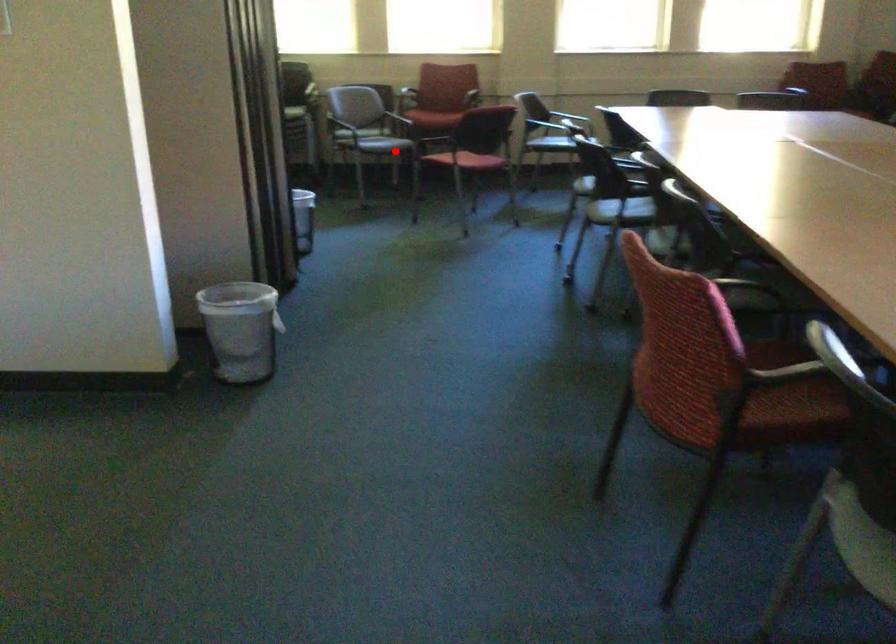
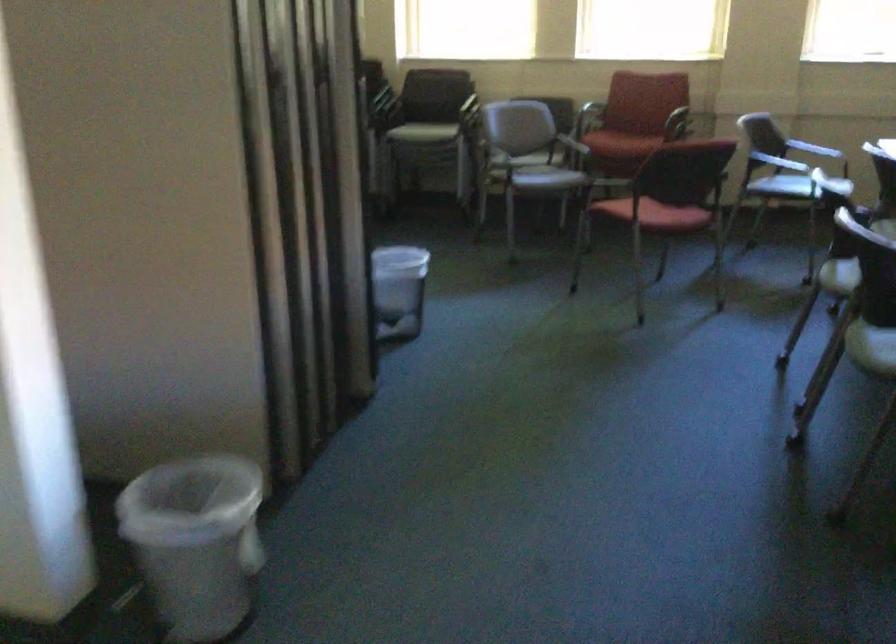
Question: I am providing you with two images of the same scene from different viewpoints. Image1 has a red point marked. In image2, the corresponding 3D location appears at what relative position? Reply with the corresponding letter.

Choices:
 (A) Closer
 (B) Farther

Answer: (A)